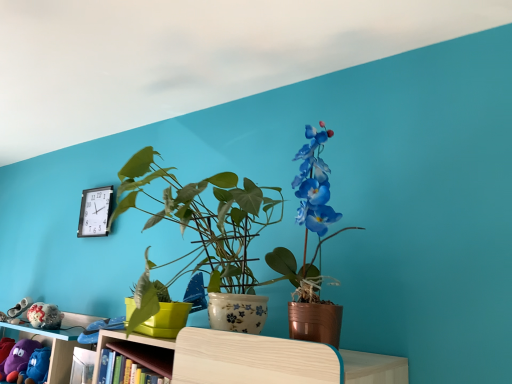
Find the location of a particular element. metallic copper pot at center is located at coordinates (306, 247).

Based on the photo, what is the approximate width of black plastic clock at upper left?

It is 1.68 inches.

Identify the location of black plastic clock at upper left. (95, 211).

The image size is (512, 384). In order to click on metallic copper pot at center in this screenshot , I will do `click(306, 247)`.

Do you think metallic copper pot at center is within black plastic clock at upper left, or outside of it?

metallic copper pot at center cannot be found inside black plastic clock at upper left.

How many degrees apart are the facing directions of metallic copper pot at center and black plastic clock at upper left?

The facing directions of metallic copper pot at center and black plastic clock at upper left are 0.00353 degrees apart.

From the image's perspective, which one is positioned lower, metallic copper pot at center or black plastic clock at upper left?

black plastic clock at upper left, from the image's perspective.

Is metallic copper pot at center in contact with black plastic clock at upper left?

metallic copper pot at center and black plastic clock at upper left are not in contact.

Is purple fabric plush at lower left wider than metallic copper pot at center?

In fact, purple fabric plush at lower left might be narrower than metallic copper pot at center.

Is purple fabric plush at lower left bigger or smaller than metallic copper pot at center?

Clearly, purple fabric plush at lower left is smaller in size than metallic copper pot at center.

What's the angular difference between purple fabric plush at lower left and metallic copper pot at center's facing directions?

The angle between the facing direction of purple fabric plush at lower left and the facing direction of metallic copper pot at center is 5.11 degrees.

Is point (14, 362) farther from camera compared to point (331, 131)?

Yes, it is.

Between black plastic clock at upper left and purple fabric plush at lower left, which one is positioned behind?

black plastic clock at upper left is behind.

Which of these two, black plastic clock at upper left or purple fabric plush at lower left, is bigger?

Bigger between the two is purple fabric plush at lower left.

Identify the location of toy in front of the black plastic clock at upper left. This screenshot has height=384, width=512. (15, 357).

Between black plastic clock at upper left and purple fabric plush at lower left, which one has larger width?

purple fabric plush at lower left.

Who is shorter, purple fabric plush at lower left or black plastic clock at upper left?

Standing shorter between the two is purple fabric plush at lower left.

Which is more distant, [31,341] or [106,209]?

The point [106,209] is more distant.

Is purple fabric plush at lower left aimed at black plastic clock at upper left?

No, purple fabric plush at lower left is not facing towards black plastic clock at upper left.

From the image's perspective, is purple fabric plush at lower left over black plastic clock at upper left?

No.

From a real-world perspective, who is located lower, black plastic clock at upper left or metallic copper pot at center?

In real-world perspective, metallic copper pot at center is lower.

Which point is more forward, [105,230] or [298,197]?

Point [298,197]

Which object is positioned more to the left, black plastic clock at upper left or metallic copper pot at center?

black plastic clock at upper left.

You are a GUI agent. You are given a task and a screenshot of the screen. Output one action in this format:
    pyautogui.click(x=<x>, y=<y>)
    Task: Click on the houseplant on the right of black plastic clock at upper left
    This screenshot has height=384, width=512.
    Given the screenshot: What is the action you would take?
    pyautogui.click(x=306, y=247)

How distant is metallic copper pot at center from purple fabric plush at lower left?

metallic copper pot at center is 1.53 meters away from purple fabric plush at lower left.

Between metallic copper pot at center and purple fabric plush at lower left, which one has larger width?

metallic copper pot at center is wider.

Who is smaller, metallic copper pot at center or purple fabric plush at lower left?

With smaller size is purple fabric plush at lower left.

Could you tell me if metallic copper pot at center is facing purple fabric plush at lower left?

No, metallic copper pot at center is not facing towards purple fabric plush at lower left.

In order to click on houseplant that is above the black plastic clock at upper left (from the image's perspective) in this screenshot , I will do `click(306, 247)`.

This screenshot has height=384, width=512. Find the location of `houseplant that appears in front of the purple fabric plush at lower left`. houseplant that appears in front of the purple fabric plush at lower left is located at coordinates (306, 247).

From the picture: Which object lies nearer to the anchor point purple fabric plush at lower left, metallic copper pot at center or black plastic clock at upper left?

black plastic clock at upper left is closer to purple fabric plush at lower left.

Estimate the real-world distances between objects in this image. Which object is further from metallic copper pot at center, purple fabric plush at lower left or black plastic clock at upper left?

Based on the image, purple fabric plush at lower left appears to be further to metallic copper pot at center.

Which object lies further to the anchor point black plastic clock at upper left, metallic copper pot at center or purple fabric plush at lower left?

metallic copper pot at center is positioned further to the anchor black plastic clock at upper left.

Looking at the image, which one is located closer to purple fabric plush at lower left, black plastic clock at upper left or metallic copper pot at center?

black plastic clock at upper left is positioned closer to the anchor purple fabric plush at lower left.

Which object lies nearer to the anchor point black plastic clock at upper left, purple fabric plush at lower left or metallic copper pot at center?

purple fabric plush at lower left is closer to black plastic clock at upper left.

Estimate the real-world distances between objects in this image. Which object is closer to metallic copper pot at center, black plastic clock at upper left or purple fabric plush at lower left?

black plastic clock at upper left lies closer to metallic copper pot at center than the other object.

Find the location of a particular element. The height and width of the screenshot is (384, 512). clock between purple fabric plush at lower left and metallic copper pot at center from left to right is located at coordinates (95, 211).